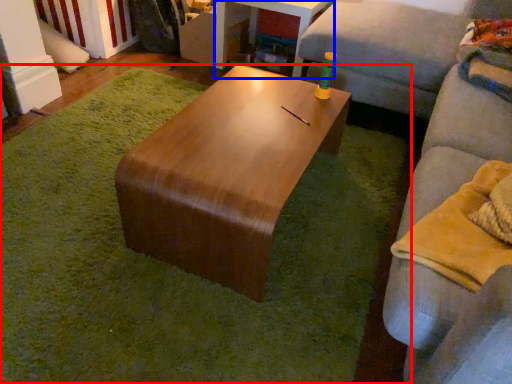
Question: Which object is closer to the camera taking this photo, mat (highlighted by a red box) or table (highlighted by a blue box)?

Choices:
 (A) mat
 (B) table

Answer: (A)